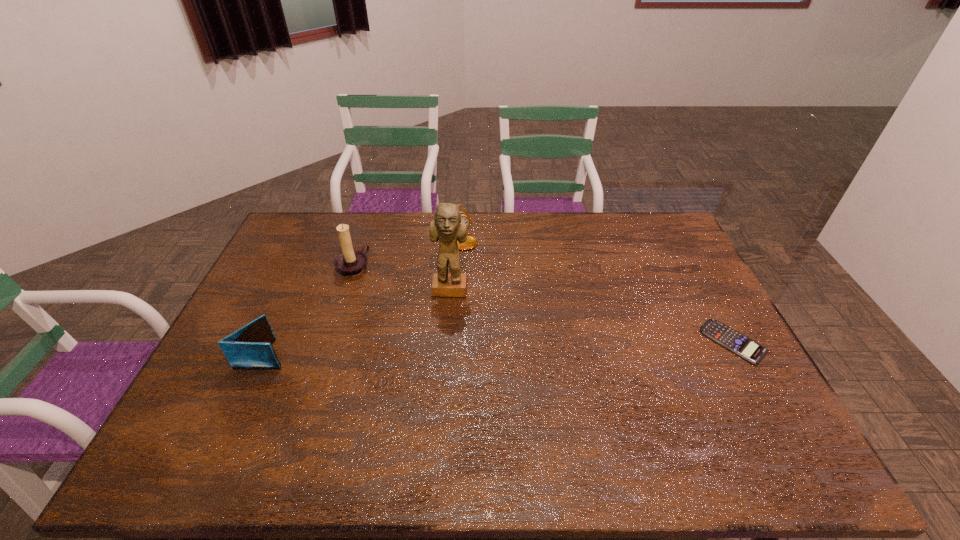
This screenshot has height=540, width=960. I want to click on free region located 0.120m on the front-facing side of the third farthest object, so click(447, 330).

This screenshot has width=960, height=540. I want to click on object that is at the far edge, so click(x=471, y=242).

Find the location of `object located at the left edge`. object located at the left edge is located at coordinates (250, 347).

The image size is (960, 540). I want to click on object present at the right edge, so click(736, 342).

Locate an element on the screen. vacant area at the far edge of the desktop is located at coordinates (430, 231).

The image size is (960, 540). I want to click on free location at the near edge of the desktop, so click(x=644, y=412).

The image size is (960, 540). Find the location of `vacant space at the right edge`. vacant space at the right edge is located at coordinates (738, 374).

Where is `free space at the far left corner of the desktop`? free space at the far left corner of the desktop is located at coordinates (299, 218).

I want to click on free point at the far right corner, so click(658, 230).

At what (x,y) coordinates should I click in order to perform the action: click on free space between the shortest object and the wallet. Please return your answer as a coordinate pair (x, y). The image size is (960, 540). Looking at the image, I should click on (499, 348).